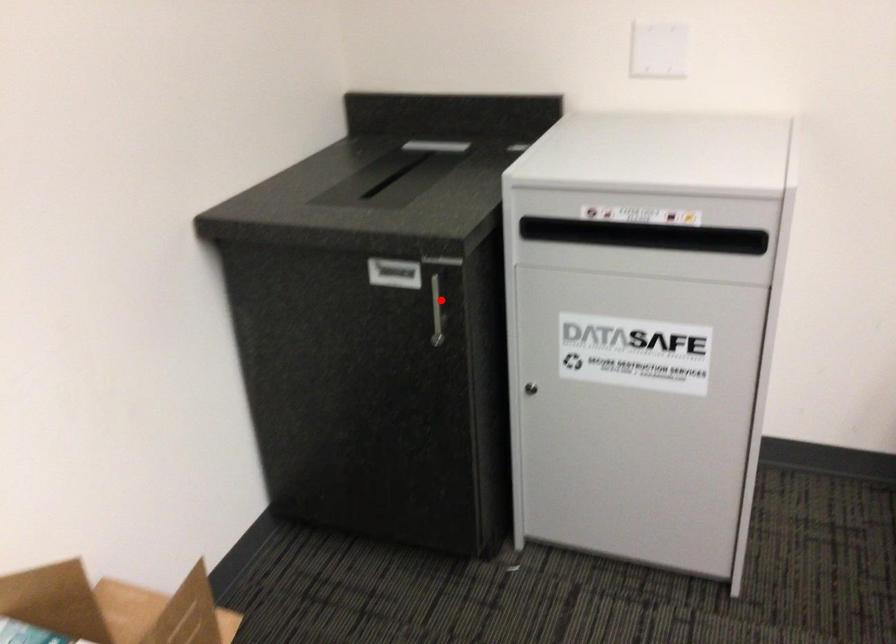
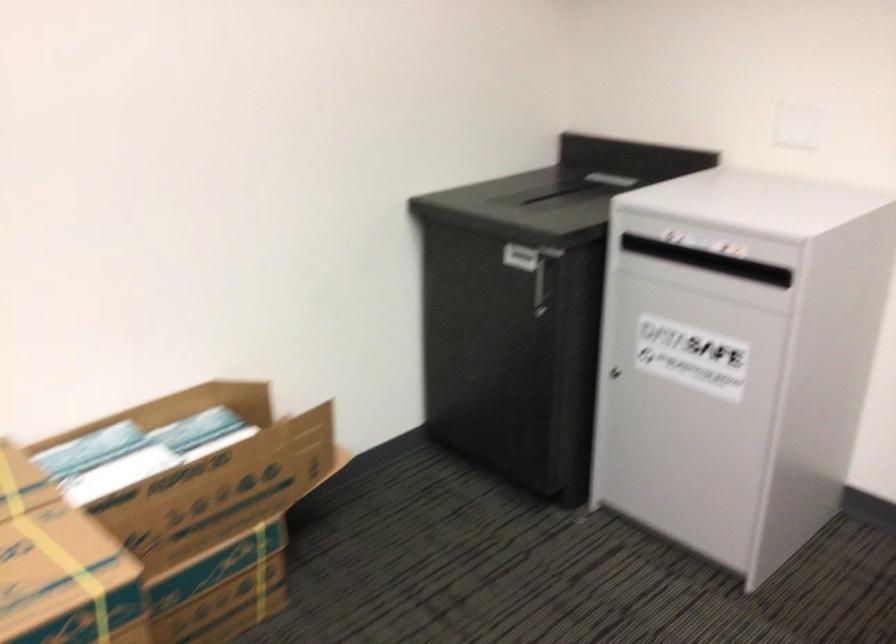
Question: I am providing you with two images of the same scene from different viewpoints. Image1 has a red point marked. In image2, the corresponding 3D location appears at what relative position? Reply with the corresponding letter.

Choices:
 (A) Closer
 (B) Farther

Answer: (B)